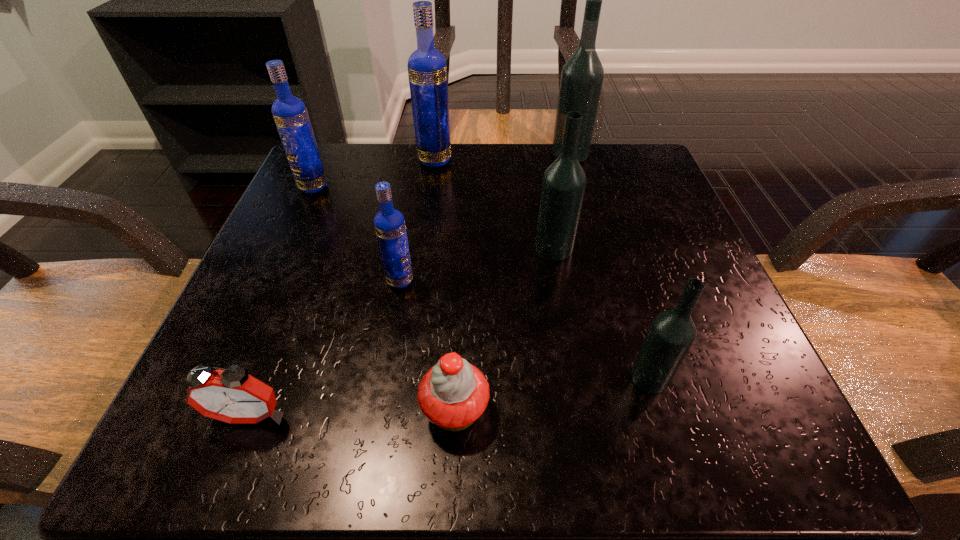
Find the location of a particular element. The image size is (960, 540). alarm clock situated at the near edge is located at coordinates (231, 395).

Where is `cupcake present at the near edge`? This screenshot has height=540, width=960. cupcake present at the near edge is located at coordinates (453, 394).

The image size is (960, 540). I want to click on vodka that is at the left edge, so click(290, 114).

The image size is (960, 540). Identify the location of alarm clock located in the left edge section of the desktop. (231, 395).

The width and height of the screenshot is (960, 540). What are the coordinates of `object that is positioned at the far left corner` in the screenshot? It's located at (290, 114).

Where is `object that is at the near left corner`? object that is at the near left corner is located at coordinates (231, 395).

In order to click on object located at the far right corner in this screenshot , I will do coord(582,75).

Where is `object present at the near right corner`? object present at the near right corner is located at coordinates (671, 334).

Locate an element on the screen. This screenshot has width=960, height=540. vacant space at the far edge is located at coordinates (470, 151).

Find the location of a particular element. Image resolution: width=960 pixels, height=540 pixels. vacant position at the near edge of the desktop is located at coordinates (415, 438).